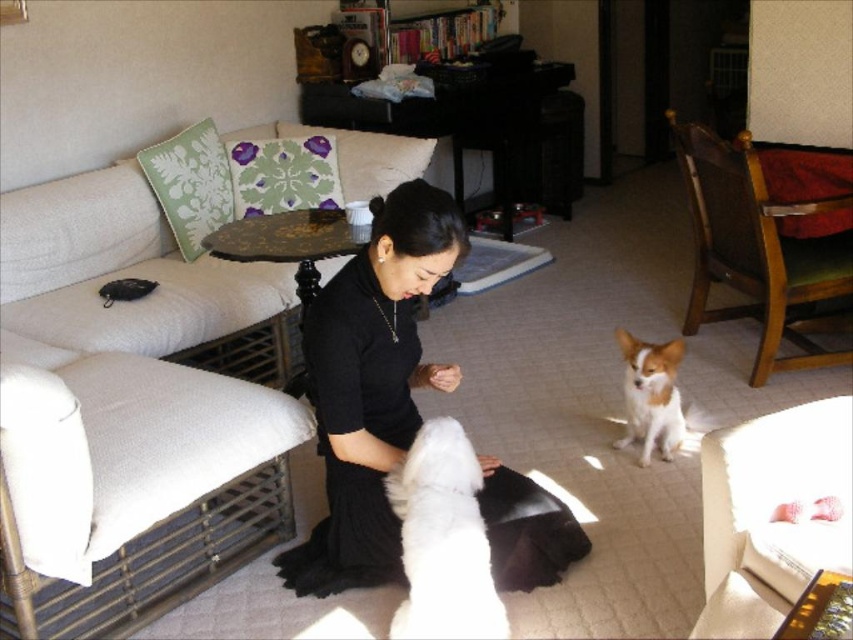
Question: Which is farther from the green fabric pillow at upper left?

Choices:
 (A) white fabric couch at upper left
 (B) black matte dress at center

Answer: (B)

Question: Which is nearer to the green floral pillow at upper left?

Choices:
 (A) white and brown fur at lower right
 (B) white fabric couch at left

Answer: (B)

Question: Which of these objects is positioned farthest from the white fabric couch at left?

Choices:
 (A) black matte dress at center
 (B) white fabric couch at lower right
 (C) white and brown fur at lower right
 (D) white fabric couch at upper left

Answer: (C)

Question: Can you confirm if white fabric couch at left is positioned above white fabric couch at lower right?

Choices:
 (A) no
 (B) yes

Answer: (B)

Question: Does white fabric couch at upper left appear on the left side of green floral pillow at upper left?

Choices:
 (A) no
 (B) yes

Answer: (B)

Question: Is white fabric couch at lower right positioned in front of green fabric pillow at upper left?

Choices:
 (A) yes
 (B) no

Answer: (A)